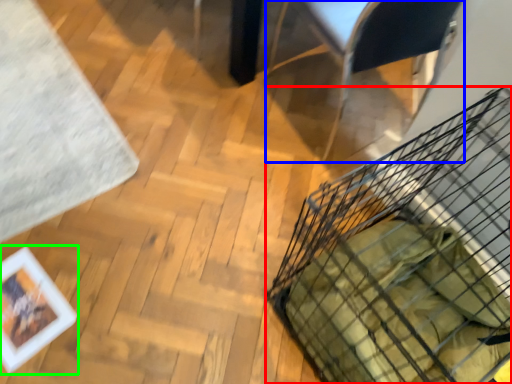
Question: Considering the real-world distances, which object is closest to basket (highlighted by a red box)? armchair (highlighted by a blue box) or picture frame (highlighted by a green box).

Choices:
 (A) armchair
 (B) picture frame

Answer: (A)